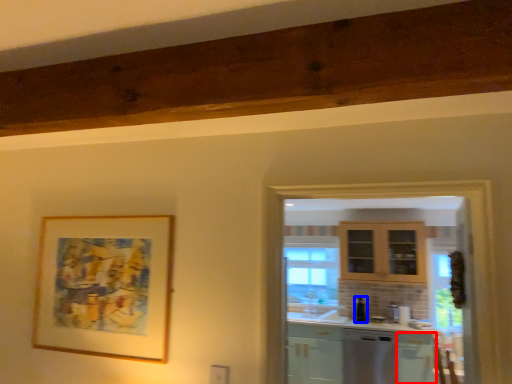
Question: Which object is further to the camera taking this photo, cabinetry (highlighted by a red box) or appliance (highlighted by a blue box)?

Choices:
 (A) cabinetry
 (B) appliance

Answer: (B)